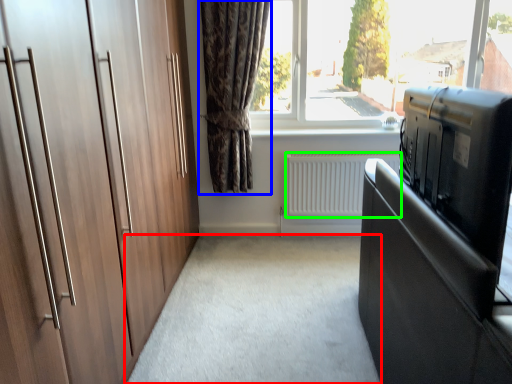
Question: Considering the real-world distances, which object is farthest from plain (highlighted by a red box)? curtain (highlighted by a blue box) or radiator (highlighted by a green box)?

Choices:
 (A) curtain
 (B) radiator

Answer: (A)